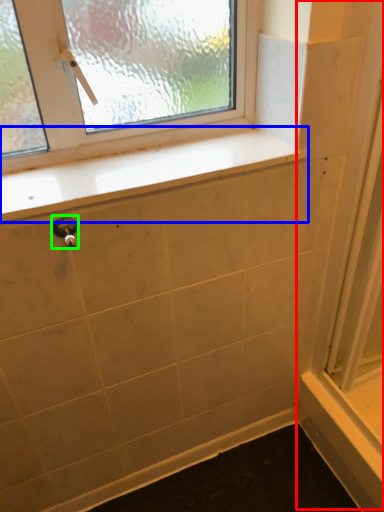
Question: Which object is positioned farthest from screen door (highlighted by a red box)? Select from window sill (highlighted by a blue box) and door handle (highlighted by a green box).

Choices:
 (A) window sill
 (B) door handle

Answer: (B)